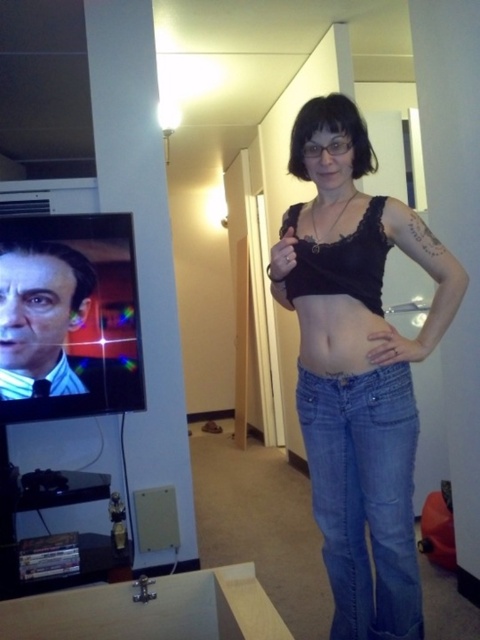
You are a photographer standing at the camera position. You want to take a photo of the person in the living room. The person is currently pointing at their own chest. To ensure their hand doesn not block the TV screen in the background, where should you position the camera relative to the point at coordinates (408,419)?

The camera should be positioned to the left of the point at coordinates (408,419) because the person is pointing towards their chest, and moving the camera left would keep their hand from blocking the TV screen.

You are a fashion designer analyzing a photo of a person wearing a black lace top at center and denim jeans at center. Based on their positioning, which clothing item is more to the left?

The black lace top at center is positioned on the right side of denim jeans at center, so the denim jeans at center are more to the left.